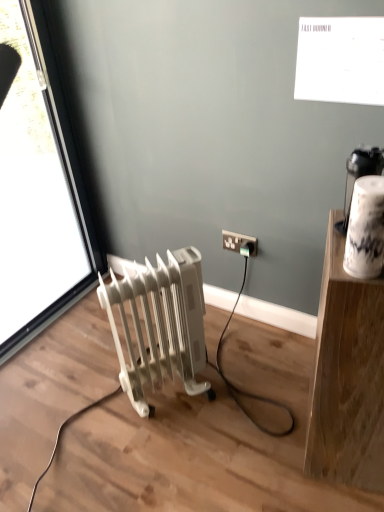
Question: Should I look upward or downward to see white plastic socket at lower right?

Choices:
 (A) up
 (B) down

Answer: (A)

Question: Is transparent glass window at left surrounding white plastic radiator at lower left?

Choices:
 (A) yes
 (B) no

Answer: (B)

Question: From the image's perspective, is transparent glass window at left located beneath white plastic radiator at lower left?

Choices:
 (A) yes
 (B) no

Answer: (B)

Question: From a real-world perspective, is transparent glass window at left physically above white plastic radiator at lower left?

Choices:
 (A) yes
 (B) no

Answer: (A)

Question: Is transparent glass window at left facing towards white plastic radiator at lower left?

Choices:
 (A) yes
 (B) no

Answer: (A)

Question: From the image's perspective, is transparent glass window at left located above white plastic radiator at lower left?

Choices:
 (A) no
 (B) yes

Answer: (B)

Question: Is transparent glass window at left closer to camera compared to white plastic radiator at lower left?

Choices:
 (A) yes
 (B) no

Answer: (A)

Question: Is white plastic radiator at lower left inside white wood shelf at upper right?

Choices:
 (A) no
 (B) yes

Answer: (A)

Question: From the image's perspective, would you say white wood shelf at upper right is shown under white plastic radiator at lower left?

Choices:
 (A) no
 (B) yes

Answer: (B)

Question: Considering the relative positions of white wood shelf at upper right and white plastic radiator at lower left in the image provided, is white wood shelf at upper right behind white plastic radiator at lower left?

Choices:
 (A) yes
 (B) no

Answer: (B)

Question: From a real-world perspective, is white wood shelf at upper right on top of white plastic radiator at lower left?

Choices:
 (A) no
 (B) yes

Answer: (B)

Question: Does white wood shelf at upper right appear on the right side of white plastic radiator at lower left?

Choices:
 (A) yes
 (B) no

Answer: (A)

Question: Is white wood shelf at upper right to the left of white plastic radiator at lower left from the viewer's perspective?

Choices:
 (A) yes
 (B) no

Answer: (B)

Question: Is white plastic radiator at lower left thinner than white plastic socket at lower right?

Choices:
 (A) no
 (B) yes

Answer: (A)